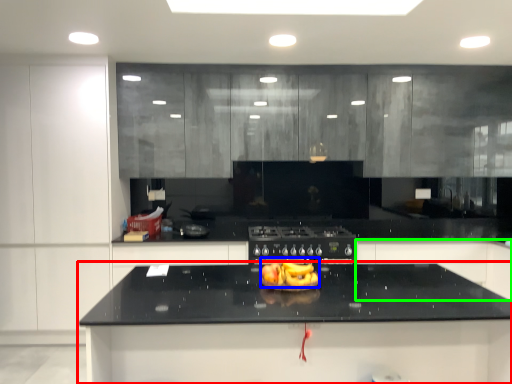
Question: Which object is positioned farthest from countertop (highlighted by a red box)? Select from food (highlighted by a blue box) and cabinetry (highlighted by a green box).

Choices:
 (A) food
 (B) cabinetry

Answer: (B)